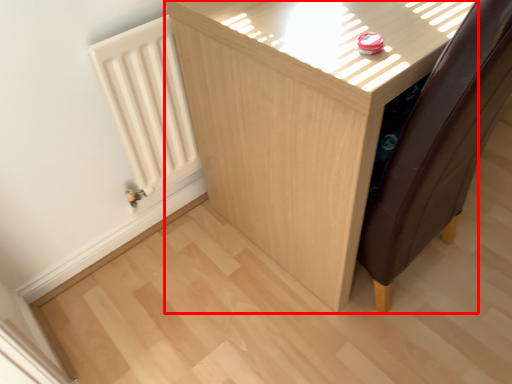
Question: In this image, where is furniture (annotated by the red box) located relative to radiator?

Choices:
 (A) left
 (B) right

Answer: (B)